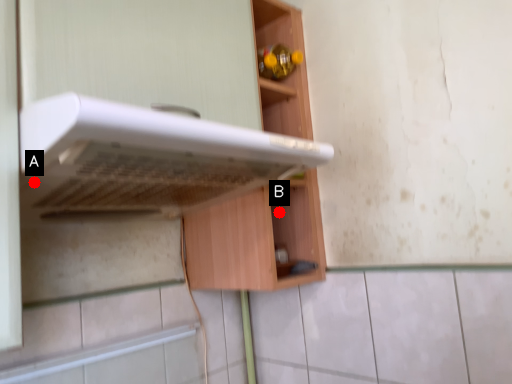
Question: Two points are circled on the image, labeled by A and B beside each circle. Among these points, which one is farthest from the camera?

Choices:
 (A) A is further
 (B) B is further

Answer: (B)